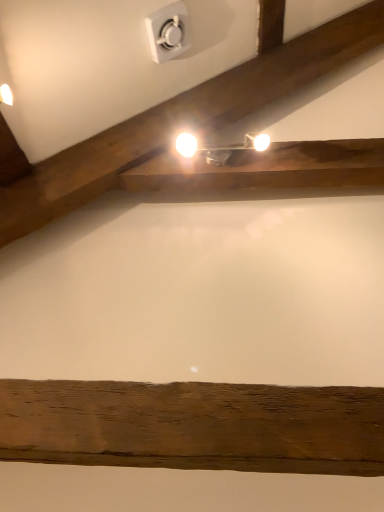
Where is `white plastic electric outlet at upper center`? This screenshot has height=512, width=384. white plastic electric outlet at upper center is located at coordinates (168, 32).

In the scene shown: Measure the distance between point (180, 33) and camera.

Point (180, 33) and camera are 4.93 feet apart from each other.

Describe the element at coordinates (168, 32) in the screenshot. I see `white plastic electric outlet at upper center` at that location.

Describe the element at coordinates (219, 147) in the screenshot. This screenshot has height=512, width=384. I see `matte silver fixture at upper center` at that location.

You are a GUI agent. You are given a task and a screenshot of the screen. Output one action in this format:
    pyautogui.click(x=<x>, y=<y>)
    Task: Click on the matte silver fixture at upper center
    The width and height of the screenshot is (384, 512).
    Given the screenshot: What is the action you would take?
    pyautogui.click(x=219, y=147)

The height and width of the screenshot is (512, 384). In order to click on white plastic electric outlet at upper center in this screenshot , I will do `click(168, 32)`.

Considering the relative positions of white plastic electric outlet at upper center and matte silver fixture at upper center in the image provided, is white plastic electric outlet at upper center to the right of matte silver fixture at upper center from the viewer's perspective?

Incorrect, white plastic electric outlet at upper center is not on the right side of matte silver fixture at upper center.

Is white plastic electric outlet at upper center in front of matte silver fixture at upper center?

Yes, white plastic electric outlet at upper center is closer to the viewer.

Considering the positions of point (169, 10) and point (217, 154), is point (169, 10) closer or farther from the camera than point (217, 154)?

Clearly, point (169, 10) is closer to the camera than point (217, 154).

From the image's perspective, between white plastic electric outlet at upper center and matte silver fixture at upper center, which one is located above?

white plastic electric outlet at upper center.

From a real-world perspective, is white plastic electric outlet at upper center under matte silver fixture at upper center?

No, from a real-world perspective, white plastic electric outlet at upper center is not beneath matte silver fixture at upper center.

Can you confirm if white plastic electric outlet at upper center is thinner than matte silver fixture at upper center?

Yes.

Between white plastic electric outlet at upper center and matte silver fixture at upper center, which one has less height?

Standing shorter between the two is matte silver fixture at upper center.

Considering the sizes of objects white plastic electric outlet at upper center and matte silver fixture at upper center in the image provided, who is bigger, white plastic electric outlet at upper center or matte silver fixture at upper center?

white plastic electric outlet at upper center.

Choose the correct answer: Is white plastic electric outlet at upper center inside matte silver fixture at upper center or outside it?

white plastic electric outlet at upper center exists outside the volume of matte silver fixture at upper center.

Are white plastic electric outlet at upper center and matte silver fixture at upper center located far from each other?

They are positioned close to each other.

Is white plastic electric outlet at upper center facing towards matte silver fixture at upper center?

No, white plastic electric outlet at upper center is not aimed at matte silver fixture at upper center.

What's the angular difference between white plastic electric outlet at upper center and matte silver fixture at upper center's facing directions?

90 degrees separate the facing orientations of white plastic electric outlet at upper center and matte silver fixture at upper center.

Measure the distance from white plastic electric outlet at upper center to matte silver fixture at upper center.

white plastic electric outlet at upper center and matte silver fixture at upper center are 37.13 centimeters apart.

Where is `electric outlet located above the matte silver fixture at upper center (from a real-world perspective)`? The width and height of the screenshot is (384, 512). electric outlet located above the matte silver fixture at upper center (from a real-world perspective) is located at coordinates point(168,32).

Considering the positions of objects matte silver fixture at upper center and white plastic electric outlet at upper center in the image provided, who is more to the left, matte silver fixture at upper center or white plastic electric outlet at upper center?

From the viewer's perspective, white plastic electric outlet at upper center appears more on the left side.

Is matte silver fixture at upper center closer to camera compared to white plastic electric outlet at upper center?

No, matte silver fixture at upper center is behind white plastic electric outlet at upper center.

Does point (251, 142) come in front of point (157, 57)?

Yes, it is.

From the image's perspective, is matte silver fixture at upper center above or below white plastic electric outlet at upper center?

Based on their image positions, matte silver fixture at upper center is located beneath white plastic electric outlet at upper center.

From a real-world perspective, is matte silver fixture at upper center beneath white plastic electric outlet at upper center?

Yes, from a real-world perspective, matte silver fixture at upper center is under white plastic electric outlet at upper center.

Which of these two, matte silver fixture at upper center or white plastic electric outlet at upper center, is wider?

matte silver fixture at upper center.

Is matte silver fixture at upper center taller than white plastic electric outlet at upper center?

In fact, matte silver fixture at upper center may be shorter than white plastic electric outlet at upper center.

Who is bigger, matte silver fixture at upper center or white plastic electric outlet at upper center?

white plastic electric outlet at upper center is bigger.

Is matte silver fixture at upper center not within white plastic electric outlet at upper center?

That's correct, matte silver fixture at upper center is outside of white plastic electric outlet at upper center.

Would you consider matte silver fixture at upper center to be distant from white plastic electric outlet at upper center?

matte silver fixture at upper center is actually quite close to white plastic electric outlet at upper center.

Is matte silver fixture at upper center facing towards white plastic electric outlet at upper center?

No, matte silver fixture at upper center is not aimed at white plastic electric outlet at upper center.

What's the angular difference between matte silver fixture at upper center and white plastic electric outlet at upper center's facing directions?

They differ by 90 degrees in their facing directions.

Image resolution: width=384 pixels, height=512 pixels. What are the coordinates of `electric outlet in front of the matte silver fixture at upper center` in the screenshot? It's located at (168, 32).

In the image, there is a white plastic electric outlet at upper center. At what (x,y) coordinates should I click in order to perform the action: click on lamp below it (from the image's perspective). Please return your answer as a coordinate pair (x, y). The width and height of the screenshot is (384, 512). Looking at the image, I should click on (219, 147).

In order to click on electric outlet on the left of matte silver fixture at upper center in this screenshot , I will do `click(168, 32)`.